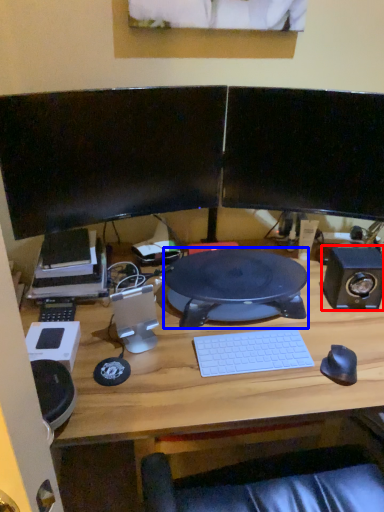
Question: Which of the following is the farthest to the observer, speaker (highlighted by a red box) or desktop (highlighted by a blue box)?

Choices:
 (A) speaker
 (B) desktop

Answer: (A)